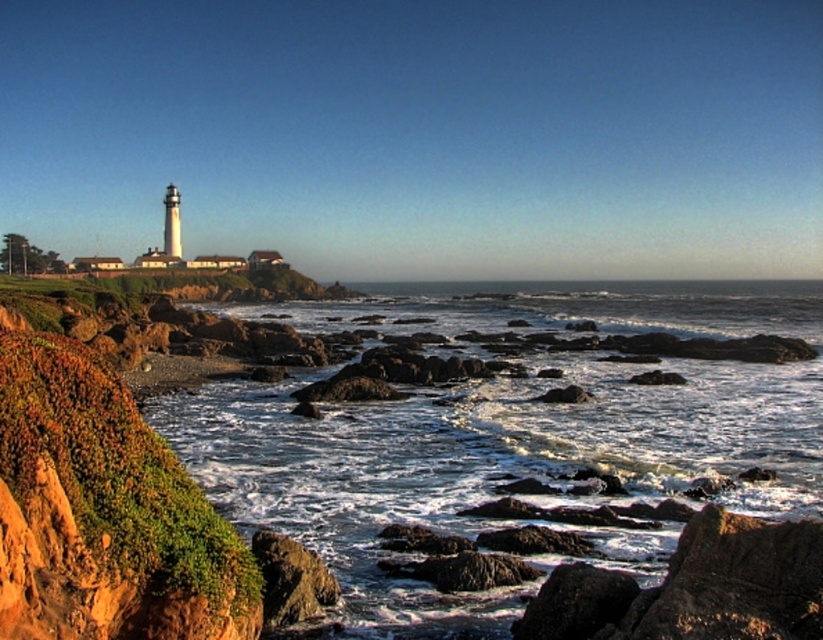
Question: Is white frothy water at lower center to the right of rustic rock cliff at left from the viewer's perspective?

Choices:
 (A) no
 (B) yes

Answer: (B)

Question: Which of the following is the farthest from the observer?

Choices:
 (A) (91, 513)
 (B) (379, 330)
 (C) (301, 604)

Answer: (B)

Question: Is rustic rock cliff at left wider than rusty rock at lower left?

Choices:
 (A) yes
 (B) no

Answer: (A)

Question: Among these points, which one is farthest from the camera?

Choices:
 (A) (295, 612)
 (B) (386, 452)
 (C) (226, 620)

Answer: (B)

Question: Which of the following is the farthest from the observer?

Choices:
 (A) (156, 589)
 (B) (291, 595)
 (C) (582, 429)

Answer: (C)

Question: Is white frothy water at lower center bigger than rusty rock at lower left?

Choices:
 (A) no
 (B) yes

Answer: (B)